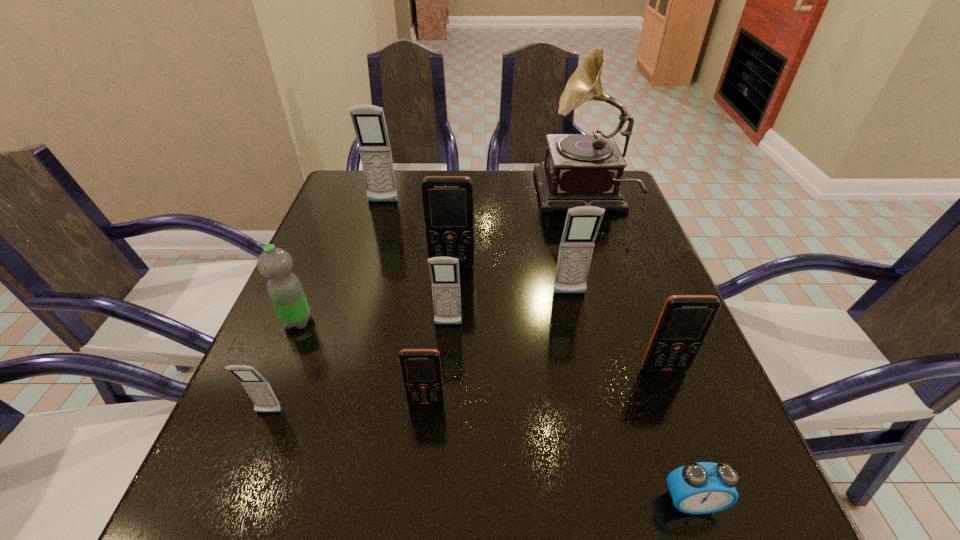
Where is `blank area in the image that satisfies the following two spatial constraints: 1. on the horn of the record player; 2. on the front-facing side of the third smallest gray cellular telephone`? blank area in the image that satisfies the following two spatial constraints: 1. on the horn of the record player; 2. on the front-facing side of the third smallest gray cellular telephone is located at coordinates (613, 294).

Identify the location of vacant space that satisfies the following two spatial constraints: 1. on the horn of the tallest object; 2. on the front-facing side of the nearest gray cellular telephone. The image size is (960, 540). (652, 413).

Where is `free spot that satisfies the following two spatial constraints: 1. on the horn of the golden record player; 2. on the screen of the biggest orange cellular telephone`? This screenshot has height=540, width=960. free spot that satisfies the following two spatial constraints: 1. on the horn of the golden record player; 2. on the screen of the biggest orange cellular telephone is located at coordinates (605, 266).

Where is `vacant space that satisfies the following two spatial constraints: 1. on the horn of the golden record player; 2. on the front-facing side of the second nearest object`? Image resolution: width=960 pixels, height=540 pixels. vacant space that satisfies the following two spatial constraints: 1. on the horn of the golden record player; 2. on the front-facing side of the second nearest object is located at coordinates (652, 413).